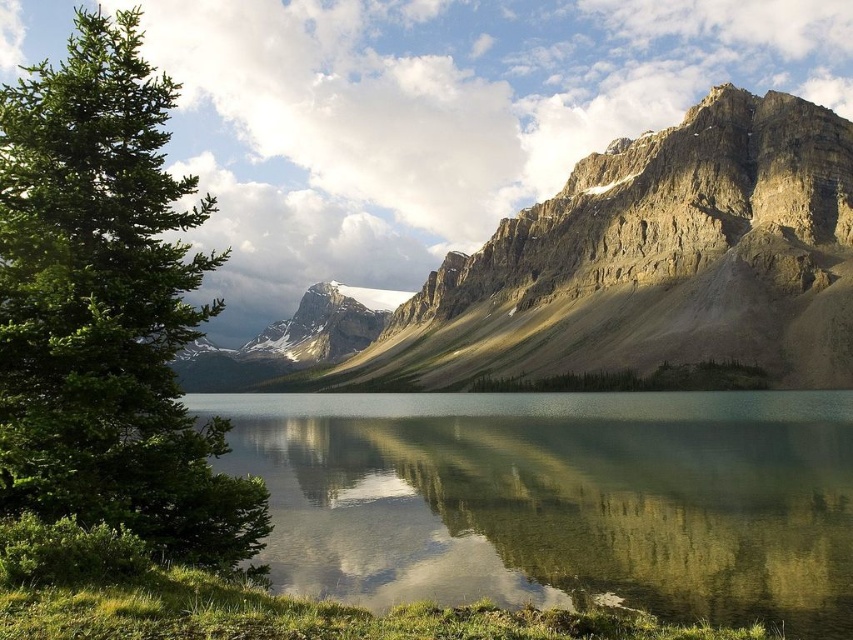
Based on the photo, can you confirm if clear glass water at center is positioned above green leafy tree at left?

No.

Which is in front, point (581, 579) or point (129, 448)?

Point (129, 448) is in front.

At what (x,y) coordinates should I click in order to perform the action: click on clear glass water at center. Please return your answer as a coordinate pair (x, y). Image resolution: width=853 pixels, height=640 pixels. Looking at the image, I should click on (558, 499).

Locate an element on the screen. This screenshot has height=640, width=853. clear glass water at center is located at coordinates (558, 499).